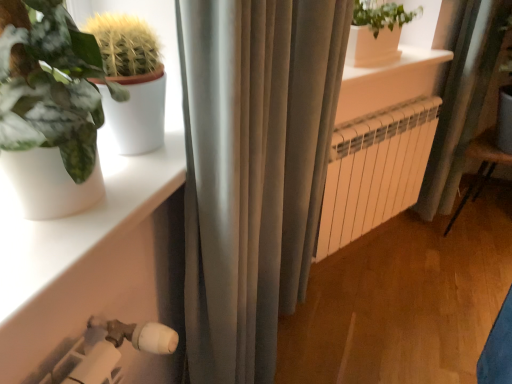
This screenshot has width=512, height=384. Describe the element at coordinates (396, 64) in the screenshot. I see `white smooth window sill at upper center` at that location.

This screenshot has width=512, height=384. I want to click on white metallic radiator at center, so click(375, 172).

Is white smooth window sill at upper center oriented towards white metallic radiator at center?

No, white smooth window sill at upper center is not aimed at white metallic radiator at center.

How different are the orientations of white smooth window sill at upper center and white metallic radiator at center in degrees?

The facing directions of white smooth window sill at upper center and white metallic radiator at center are 1.75 degrees apart.

From a real-world perspective, is white smooth window sill at upper center physically located above or below white metallic radiator at center?

white smooth window sill at upper center is situated higher than white metallic radiator at center in the real world.

Considering the sizes of objects white metallic radiator at center and white smooth window sill at upper center in the image provided, who is smaller, white metallic radiator at center or white smooth window sill at upper center?

Smaller between the two is white smooth window sill at upper center.

From a real-world perspective, is white metallic radiator at center physically below white smooth window sill at upper center?

Yes, from a real-world perspective, white metallic radiator at center is beneath white smooth window sill at upper center.

Which point is more forward, (432, 108) or (452, 53)?

Point (432, 108)

In terms of height, does white metallic radiator at center look taller or shorter compared to white smooth window sill at upper center?

Considering their sizes, white metallic radiator at center has more height than white smooth window sill at upper center.

Which object is closer to the camera taking this photo, white matte shelf at lower left or white metallic radiator at center?

white matte shelf at lower left is closer to the camera.

Is white matte shelf at lower left aimed at white metallic radiator at center?

No.

Considering the positions of objects white metallic radiator at center and wooden armchair at lower right in the image provided, who is in front, white metallic radiator at center or wooden armchair at lower right?

Positioned in front is white metallic radiator at center.

Is white metallic radiator at center not close to wooden armchair at lower right?

Actually, white metallic radiator at center and wooden armchair at lower right are a little close together.

From a real-world perspective, between white metallic radiator at center and wooden armchair at lower right, who is vertically lower?

From a 3D spatial view, wooden armchair at lower right is below.

Considering the relative positions of white matte shelf at lower left and wooden armchair at lower right in the image provided, is white matte shelf at lower left to the left or to the right of wooden armchair at lower right?

From the image, it's evident that white matte shelf at lower left is to the left of wooden armchair at lower right.

Is white matte shelf at lower left turned away from wooden armchair at lower right?

No, white matte shelf at lower left's orientation is not away from wooden armchair at lower right.

Is white matte shelf at lower left positioned in front of wooden armchair at lower right?

Yes, it is.

In the scene shown: From a real-world perspective, who is located higher, white smooth window sill at upper center or wooden armchair at lower right?

In real-world perspective, white smooth window sill at upper center is above.

Would you say white smooth window sill at upper center contains wooden armchair at lower right?

No, white smooth window sill at upper center does not contain wooden armchair at lower right.

Which of these two, white smooth window sill at upper center or wooden armchair at lower right, is smaller?

white smooth window sill at upper center.

Is white matte shelf at lower left next to white smooth window sill at upper center?

white matte shelf at lower left and white smooth window sill at upper center are not in contact.

Looking at this image, is white smooth window sill at upper center at the back of white matte shelf at lower left?

No, white matte shelf at lower left's orientation is not away from white smooth window sill at upper center.

The image size is (512, 384). What are the coordinates of `window sill above the white matte shelf at lower left (from the image's perspective)` in the screenshot? It's located at point(396,64).

Which of these two, white matte shelf at lower left or white smooth window sill at upper center, is smaller?

Smaller between the two is white matte shelf at lower left.

Image resolution: width=512 pixels, height=384 pixels. Find the location of `window sill in front of the white metallic radiator at center`. window sill in front of the white metallic radiator at center is located at coordinates (396, 64).

Image resolution: width=512 pixels, height=384 pixels. I want to click on window sill above the white metallic radiator at center (from the image's perspective), so click(x=396, y=64).

Considering their positions, is white metallic radiator at center positioned further to wooden armchair at lower right than white smooth window sill at upper center?

Among the two, white smooth window sill at upper center is located further to wooden armchair at lower right.

Considering their positions, is white smooth window sill at upper center positioned closer to white metallic radiator at center than wooden armchair at lower right?

white smooth window sill at upper center lies closer to white metallic radiator at center than the other object.

In the scene shown: Considering their positions, is white matte shelf at lower left positioned closer to white smooth window sill at upper center than white metallic radiator at center?

Among the two, white metallic radiator at center is located nearer to white smooth window sill at upper center.

Consider the image. Based on their spatial positions, is white smooth window sill at upper center or white matte shelf at lower left closer to white metallic radiator at center?

white smooth window sill at upper center is positioned closer to the anchor white metallic radiator at center.

Which object lies further to the anchor point white metallic radiator at center, white matte shelf at lower left or white smooth window sill at upper center?

white matte shelf at lower left is positioned further to the anchor white metallic radiator at center.

When comparing their distances from wooden armchair at lower right, does white smooth window sill at upper center or white metallic radiator at center seem further?

white smooth window sill at upper center is further to wooden armchair at lower right.

In the scene shown: Considering their positions, is white metallic radiator at center positioned further to wooden armchair at lower right than white matte shelf at lower left?

white matte shelf at lower left lies further to wooden armchair at lower right than the other object.

Looking at the image, which one is located closer to white metallic radiator at center, white matte shelf at lower left or wooden armchair at lower right?

wooden armchair at lower right lies closer to white metallic radiator at center than the other object.

Locate an element on the screen. window sill positioned between white matte shelf at lower left and white metallic radiator at center from near to far is located at coordinates (396, 64).

Image resolution: width=512 pixels, height=384 pixels. Find the location of `window sill situated between white matte shelf at lower left and wooden armchair at lower right from left to right`. window sill situated between white matte shelf at lower left and wooden armchair at lower right from left to right is located at coordinates (396, 64).

At what (x,y) coordinates should I click in order to perform the action: click on radiator situated between white smooth window sill at upper center and wooden armchair at lower right from left to right. Please return your answer as a coordinate pair (x, y). This screenshot has height=384, width=512. Looking at the image, I should click on (375, 172).

Locate an element on the screen. The width and height of the screenshot is (512, 384). radiator between white matte shelf at lower left and wooden armchair at lower right from left to right is located at coordinates (375, 172).